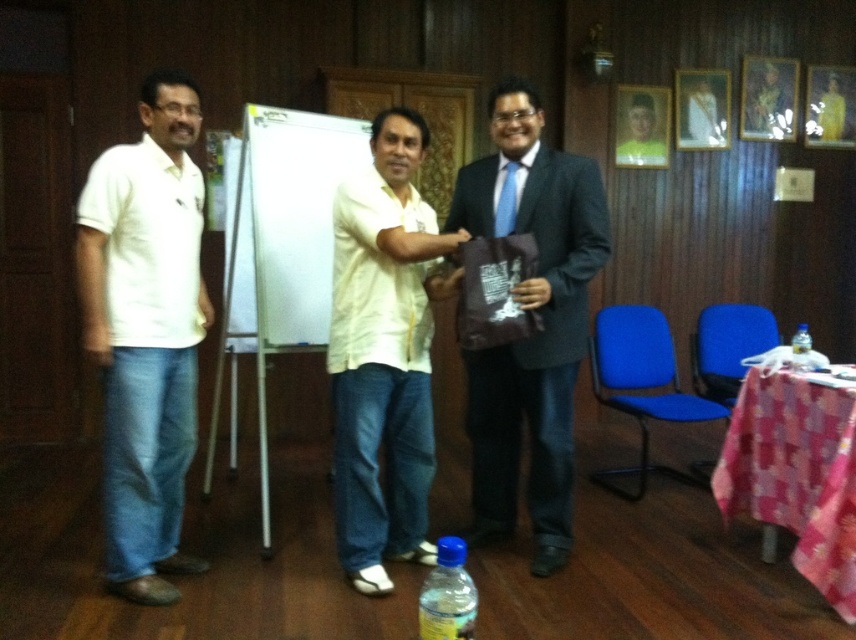
Between white cotton shirt at left and translucent plastic bottle at center, which one is positioned lower?

translucent plastic bottle at center is lower down.

Does white cotton shirt at left appear over translucent plastic bottle at center?

Yes.

Measure the distance between point (153, 275) and camera.

They are 2.44 meters apart.

Where is `white cotton shirt at left`? This screenshot has height=640, width=856. white cotton shirt at left is located at coordinates (146, 332).

Which is behind, point (336, 364) or point (465, 620)?

Positioned behind is point (336, 364).

Is light yellow shirt at center to the right of translucent plastic bottle at lower center from the viewer's perspective?

No, light yellow shirt at center is not to the right of translucent plastic bottle at lower center.

The width and height of the screenshot is (856, 640). I want to click on light yellow shirt at center, so click(384, 353).

Is white cotton shirt at left to the right of whiteboard at center from the viewer's perspective?

Incorrect, white cotton shirt at left is not on the right side of whiteboard at center.

Which is in front, point (119, 346) or point (224, 224)?

Point (119, 346) is in front.

Between point (188, 216) and point (250, 200), which one is positioned in front?

Point (188, 216)

Locate an element on the screen. This screenshot has width=856, height=640. white cotton shirt at left is located at coordinates (146, 332).